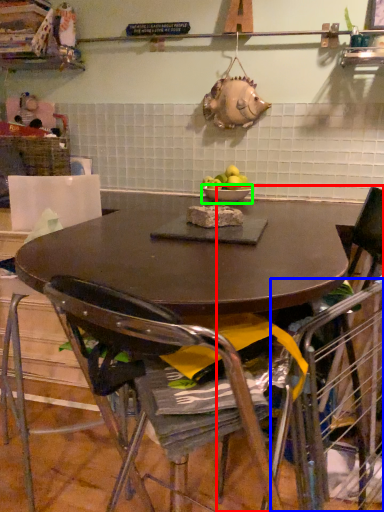
Question: Considering the real-world distances, which object is farthest from chair (highlighted by a red box)? armchair (highlighted by a blue box) or bowl (highlighted by a green box)?

Choices:
 (A) armchair
 (B) bowl

Answer: (B)